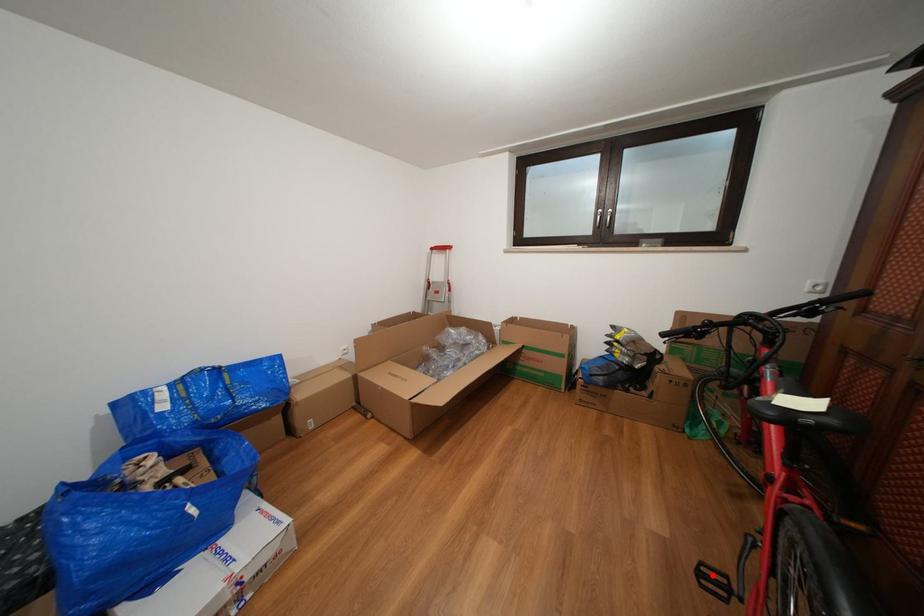
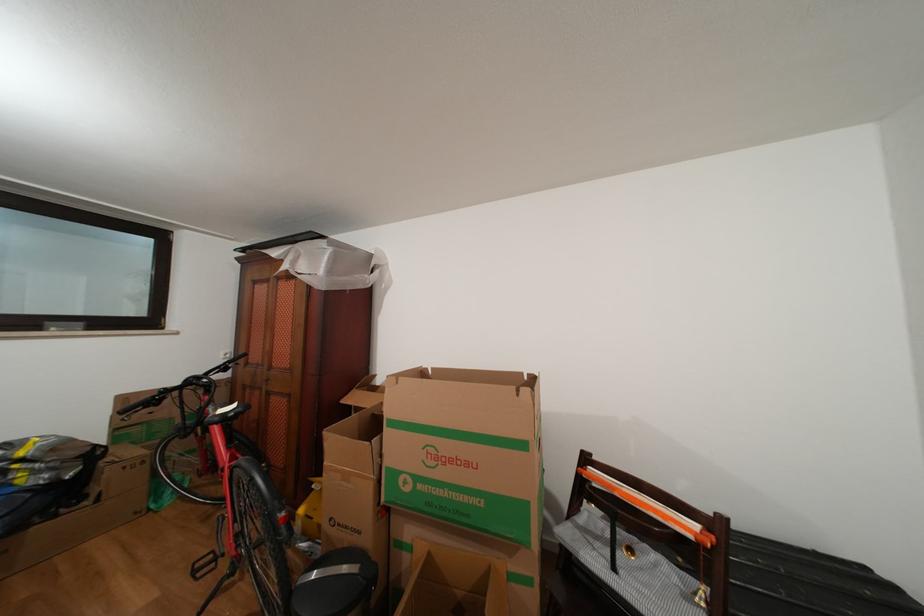
Question: I am providing you with two images of the same scene from different viewpoints. Image1 has a red point marked. In image2, the corresponding 3D location appears at what relative position? Reply with the corresponding letter.

Choices:
 (A) Closer
 (B) Farther

Answer: (A)